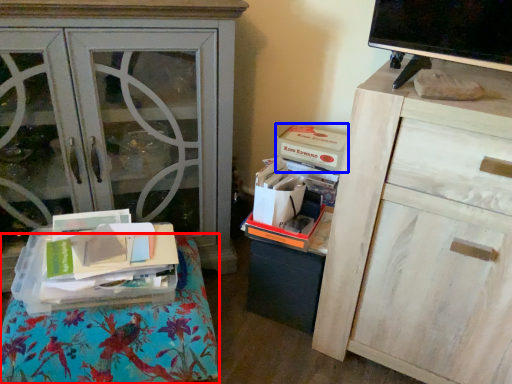
Question: Which object appears closest to the camera in this image, furniture (highlighted by a red box) or storage box (highlighted by a blue box)?

Choices:
 (A) furniture
 (B) storage box

Answer: (A)